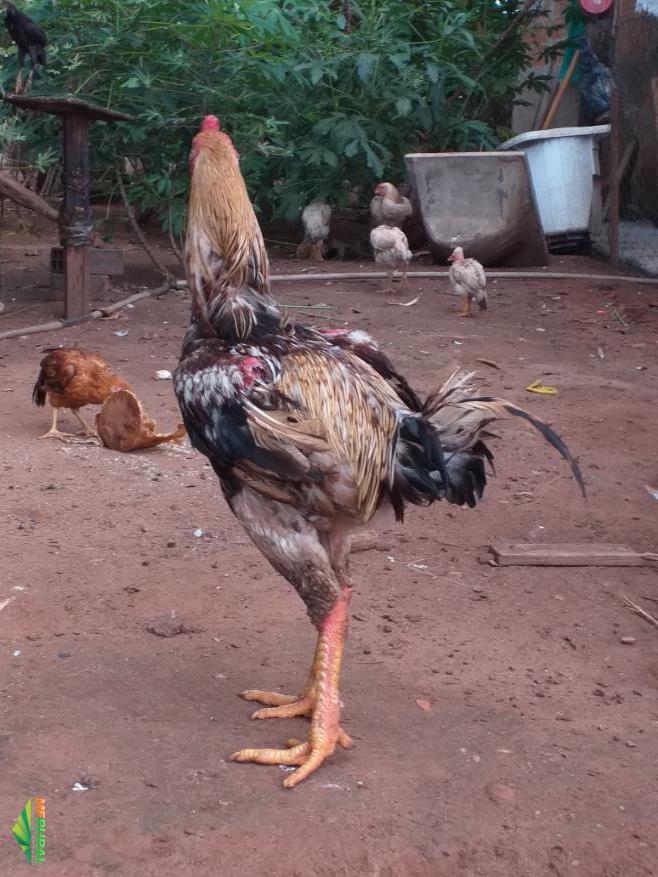
Find the location of a particular element. This screenshot has width=658, height=877. white plastic bin is located at coordinates (563, 188).